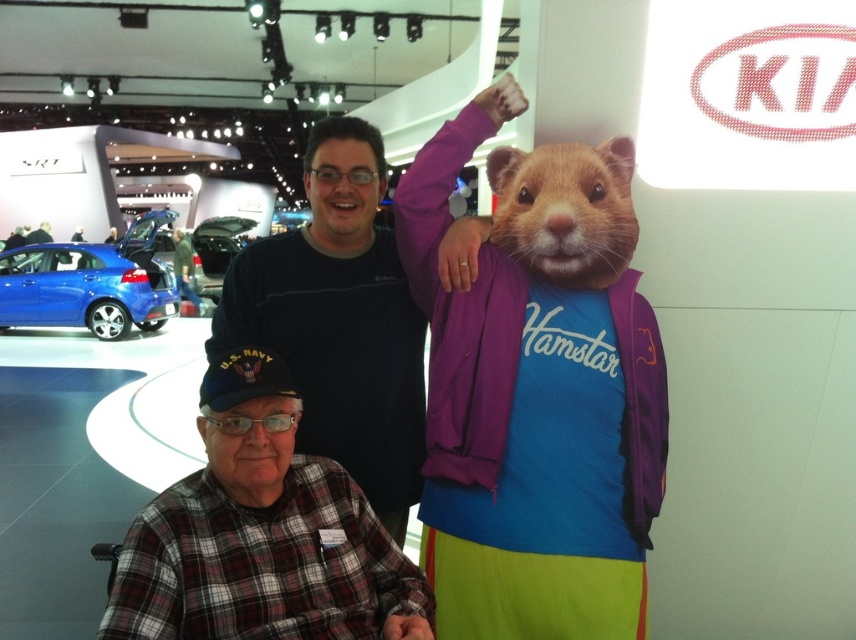
You are at the Kia booth at the auto show and want to find the person wearing the dark blue cotton shirt at center. According to the scene description, where should you look relative to the blue sedan and black SUV?

The dark blue cotton shirt at center is located at point 0.503 in the x coordinate and 0.397 in the y coordinate, which places it centrally in the image. Since the blue sedan and black SUV are partially visible in the background, the person in the dark blue cotton shirt at center would be positioned in the middle area of the scene, between the foreground individuals and the displayed cars.

You are a photographer at the Kia booth and want to ensure both the dark blue cotton shirt at center and the shiny metallic car at center are clearly visible in your photo. Based on their heights, which one might need to be positioned closer to the camera to maintain visibility?

The dark blue cotton shirt at center has a lesser height compared to the shiny metallic car at center. To ensure both are clearly visible, the dark blue cotton shirt at center should be positioned closer to the camera so its smaller size doesn